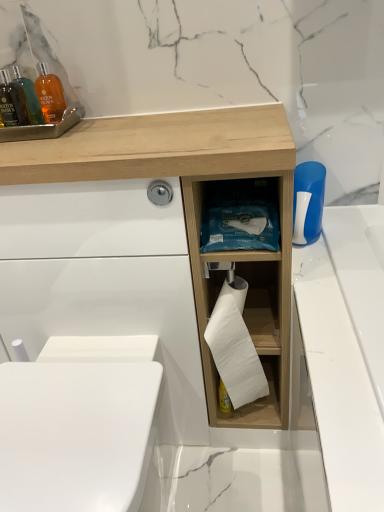
Question: Is blue plastic brush at right with white matte toilet paper at center?

Choices:
 (A) no
 (B) yes

Answer: (A)

Question: From the image's perspective, is blue plastic brush at right located beneath white matte toilet paper at center?

Choices:
 (A) yes
 (B) no

Answer: (B)

Question: Is blue plastic brush at right completely or partially outside of white matte toilet paper at center?

Choices:
 (A) yes
 (B) no

Answer: (A)

Question: Does blue plastic brush at right have a lesser height compared to white matte toilet paper at center?

Choices:
 (A) no
 (B) yes

Answer: (B)

Question: Does blue plastic brush at right appear on the left side of white matte toilet paper at center?

Choices:
 (A) no
 (B) yes

Answer: (A)

Question: Can you confirm if blue plastic brush at right is bigger than white matte toilet paper at center?

Choices:
 (A) yes
 (B) no

Answer: (B)

Question: Is translucent amber bottle at upper left, the 2th mouthwash positioned from the back, at the right side of translucent orange bottle at upper left, positioned as the 2th mouthwash in front-to-back order?

Choices:
 (A) yes
 (B) no

Answer: (B)

Question: Could you tell me if translucent amber bottle at upper left, which is counted as the first mouthwash, starting from the front, is facing translucent orange bottle at upper left, marked as the 1th mouthwash in a back-to-front arrangement?

Choices:
 (A) no
 (B) yes

Answer: (B)

Question: Would you say translucent orange bottle at upper left, positioned as the 2th mouthwash in front-to-back order, is part of translucent amber bottle at upper left, which is counted as the first mouthwash, starting from the front,'s contents?

Choices:
 (A) yes
 (B) no

Answer: (B)

Question: From the image's perspective, is translucent amber bottle at upper left, the 2th mouthwash positioned from the back, above translucent orange bottle at upper left, positioned as the 2th mouthwash in front-to-back order?

Choices:
 (A) no
 (B) yes

Answer: (A)

Question: Is translucent amber bottle at upper left, the 2th mouthwash positioned from the back, touching translucent orange bottle at upper left, marked as the 1th mouthwash in a back-to-front arrangement?

Choices:
 (A) yes
 (B) no

Answer: (A)

Question: Is translucent amber bottle at upper left, the 2th mouthwash positioned from the back, positioned beyond the bounds of translucent orange bottle at upper left, positioned as the 2th mouthwash in front-to-back order?

Choices:
 (A) yes
 (B) no

Answer: (A)

Question: From the image's perspective, is translucent orange bottle at upper left, marked as the 1th mouthwash in a back-to-front arrangement, below white matte toilet paper at center?

Choices:
 (A) no
 (B) yes

Answer: (A)